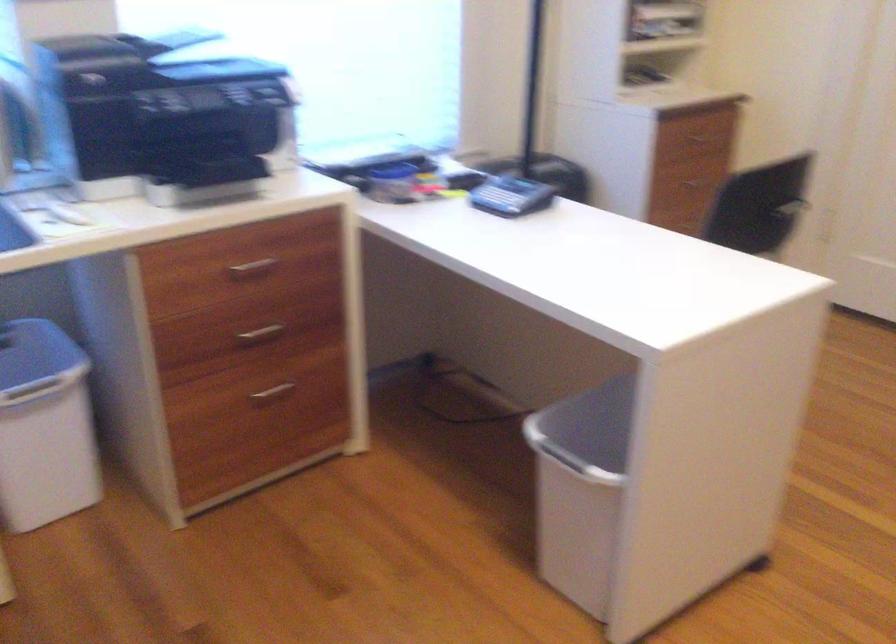
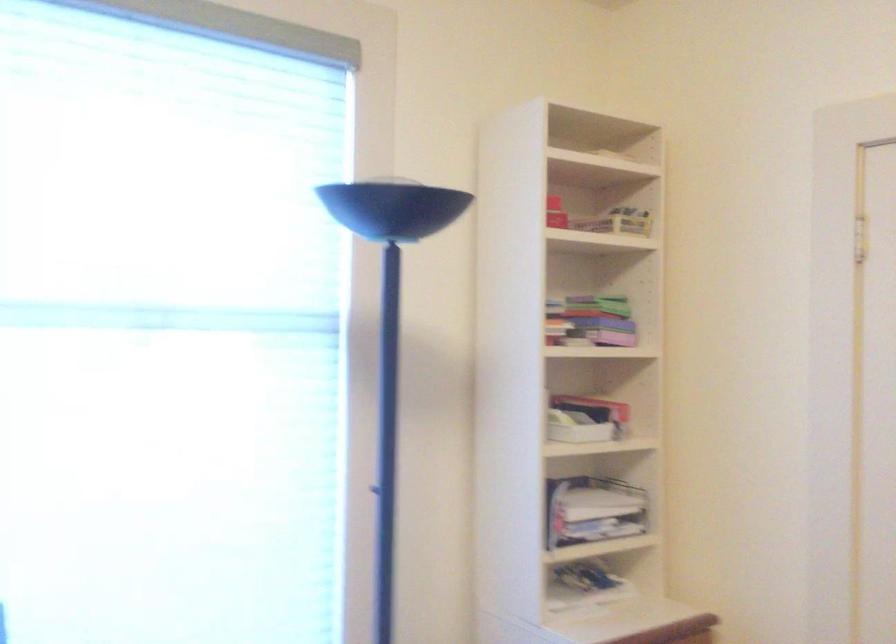
The images are taken continuously from a first-person perspective. In which direction are you moving?

The cameraman moved toward right, forward.